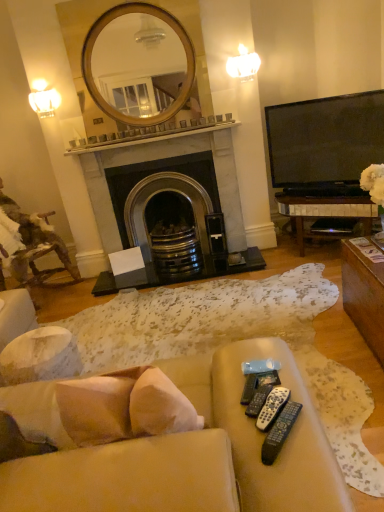
The width and height of the screenshot is (384, 512). Find the location of `free space above white marble fireplace at center (from a real-world perspective)`. free space above white marble fireplace at center (from a real-world perspective) is located at coordinates (146, 136).